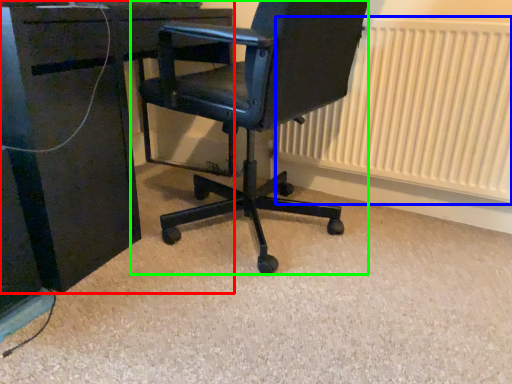
Question: Which is nearer to the desk (highlighted by a red box)? radiator (highlighted by a blue box) or chair (highlighted by a green box).

Choices:
 (A) radiator
 (B) chair

Answer: (B)